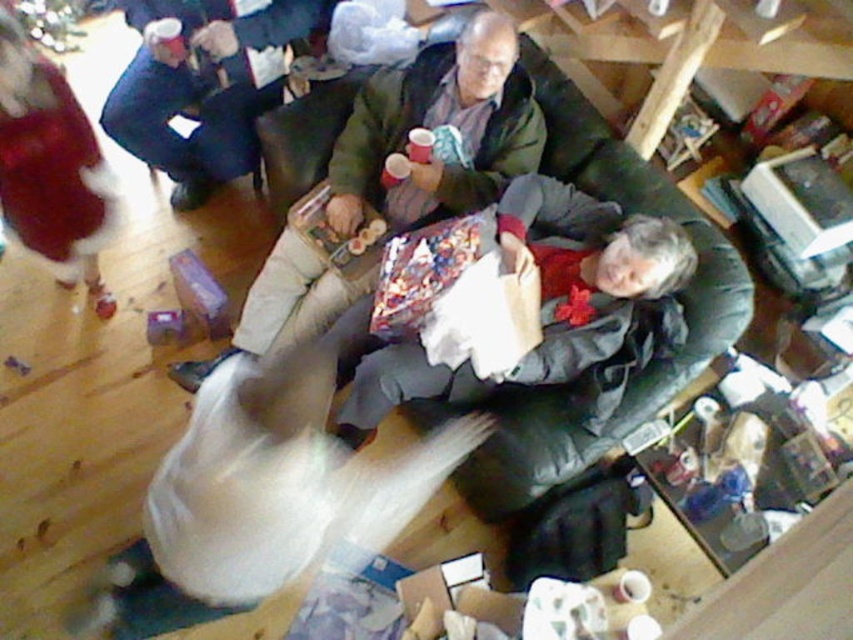
You are helping to organize the seating arrangement for a small gathering. You have a green fabric jacket at center and a dark green leather couch at center in the room. Which object takes up more space in the room?

The dark green leather couch at center takes up more space in the room since the green fabric jacket at center is smaller in size compared to it.

You are a guest at this gathering and want to sit down. There is a dark green leather couch at center and dark blue jeans at upper left. Which one is closer to you?

The dark green leather couch at center is closer to you since it is in front of the dark blue jeans at upper left.